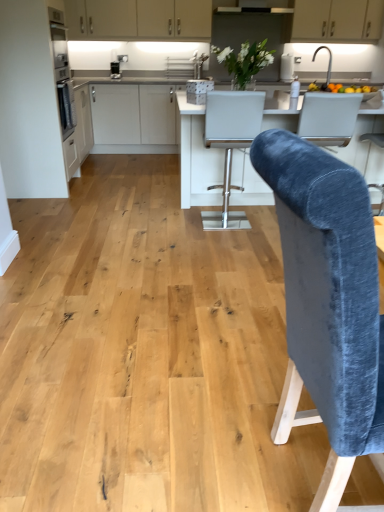
The width and height of the screenshot is (384, 512). Find the location of `vacant space in front of white leather bar stool at center, the 2th chair when ordered from bottom to top`. vacant space in front of white leather bar stool at center, the 2th chair when ordered from bottom to top is located at coordinates (231, 244).